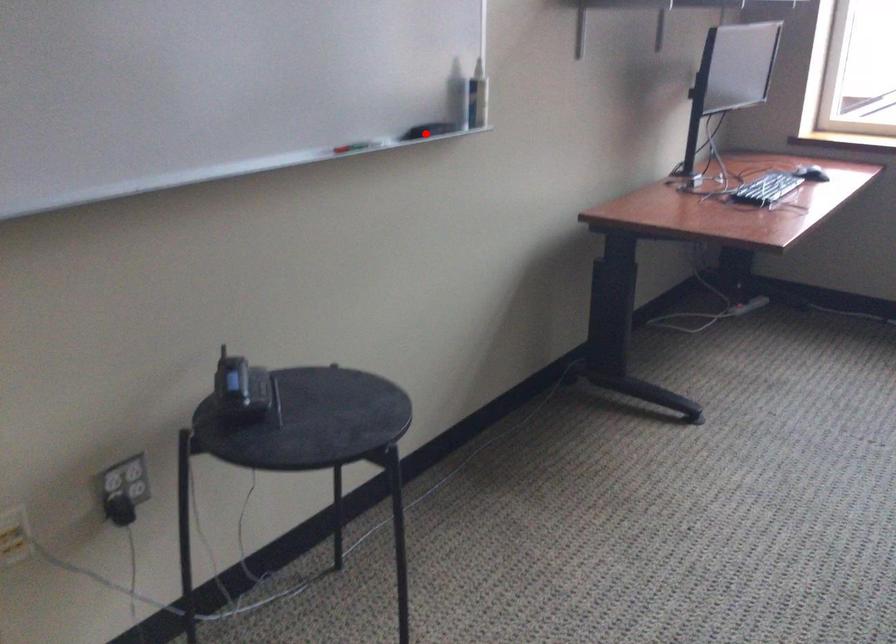
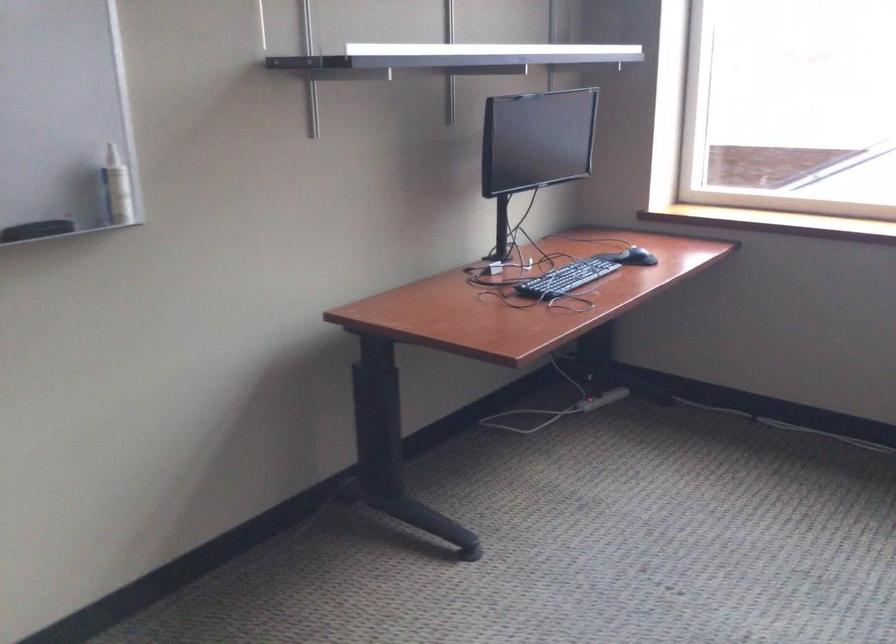
Locate, in the second image, the point that corresponds to the highlighted location in the first image.

(36, 230)